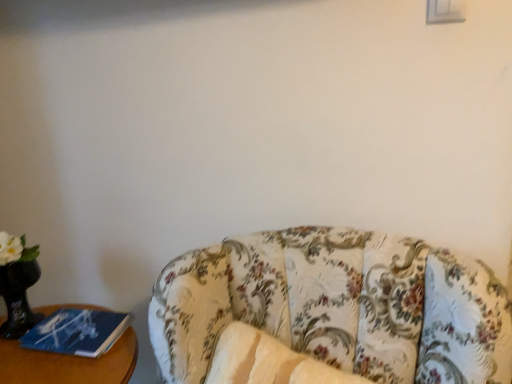
Describe the element at coordinates (68, 364) in the screenshot. I see `blue paper at left` at that location.

At what (x,y) coordinates should I click in order to perform the action: click on blue paper at left. Please return your answer as a coordinate pair (x, y). This screenshot has height=384, width=512. Looking at the image, I should click on (68, 364).

This screenshot has width=512, height=384. What do you see at coordinates (337, 305) in the screenshot? I see `floral fabric couch at lower right` at bounding box center [337, 305].

Where is `floral fabric couch at lower right`? floral fabric couch at lower right is located at coordinates (337, 305).

Measure the distance between point (x=305, y=285) and camera.

The depth of point (x=305, y=285) is 36.69 inches.

Find the location of `blue paper at left`. blue paper at left is located at coordinates (68, 364).

Considering the positions of objects blue paper at left and floral fabric couch at lower right in the image provided, who is more to the right, blue paper at left or floral fabric couch at lower right?

From the viewer's perspective, floral fabric couch at lower right appears more on the right side.

In the image, is blue paper at left positioned in front of or behind floral fabric couch at lower right?

In the image, blue paper at left appears behind floral fabric couch at lower right.

Is point (119, 349) closer or farther from the camera than point (175, 348)?

Point (119, 349) is positioned farther from the camera compared to point (175, 348).

From the image's perspective, which is above, blue paper at left or floral fabric couch at lower right?

From the image's view, blue paper at left is above.

From a real-world perspective, which object stands above the other?

In real-world perspective, floral fabric couch at lower right is above.

Which object is wider, blue paper at left or floral fabric couch at lower right?

Wider between the two is floral fabric couch at lower right.

Considering the relative sizes of blue paper at left and floral fabric couch at lower right in the image provided, is blue paper at left shorter than floral fabric couch at lower right?

Yes.

Based on their sizes in the image, would you say blue paper at left is bigger or smaller than floral fabric couch at lower right?

Clearly, blue paper at left is smaller in size than floral fabric couch at lower right.

Is blue paper at left positioned beyond the bounds of floral fabric couch at lower right?

Absolutely, blue paper at left is external to floral fabric couch at lower right.

Is blue paper at left far away from floral fabric couch at lower right?

No, there isn't a large distance between blue paper at left and floral fabric couch at lower right.

Is blue paper at left oriented towards floral fabric couch at lower right?

No, blue paper at left is not oriented towards floral fabric couch at lower right.

How different are the orientations of blue paper at left and floral fabric couch at lower right in degrees?

The angle between the facing direction of blue paper at left and the facing direction of floral fabric couch at lower right is 4.6 degrees.

Find the location of a particular element. studio couch above the blue paper at left (from a real-world perspective) is located at coordinates (337, 305).

Does floral fabric couch at lower right appear on the left side of blue paper at left?

In fact, floral fabric couch at lower right is to the right of blue paper at left.

Which object is more forward, floral fabric couch at lower right or blue paper at left?

floral fabric couch at lower right is more forward.

Which is behind, point (394, 313) or point (76, 364)?

Point (76, 364)

Based on the photo, from the image's perspective, which is below, floral fabric couch at lower right or blue paper at left?

floral fabric couch at lower right is shown below in the image.

From a real-world perspective, is floral fabric couch at lower right positioned above or below blue paper at left?

floral fabric couch at lower right is situated higher than blue paper at left in the real world.

Is floral fabric couch at lower right thinner than blue paper at left?

In fact, floral fabric couch at lower right might be wider than blue paper at left.

Who is taller, floral fabric couch at lower right or blue paper at left?

Standing taller between the two is floral fabric couch at lower right.

Considering the relative sizes of floral fabric couch at lower right and blue paper at left in the image provided, is floral fabric couch at lower right smaller than blue paper at left?

Actually, floral fabric couch at lower right might be larger than blue paper at left.

Is blue paper at left completely or partially inside floral fabric couch at lower right?

No, blue paper at left is located outside of floral fabric couch at lower right.

Are floral fabric couch at lower right and blue paper at left beside each other?

No, floral fabric couch at lower right is not with blue paper at left.

Does floral fabric couch at lower right turn towards blue paper at left?

No, floral fabric couch at lower right does not turn towards blue paper at left.

What's the angular difference between floral fabric couch at lower right and blue paper at left's facing directions?

floral fabric couch at lower right and blue paper at left are facing 4.6 degrees away from each other.

Where is `furniture on the left of floral fabric couch at lower right`? The width and height of the screenshot is (512, 384). furniture on the left of floral fabric couch at lower right is located at coordinates (68, 364).

Image resolution: width=512 pixels, height=384 pixels. I want to click on studio couch below the blue paper at left (from the image's perspective), so click(x=337, y=305).

Identify the location of studio couch lying in front of the blue paper at left. (337, 305).